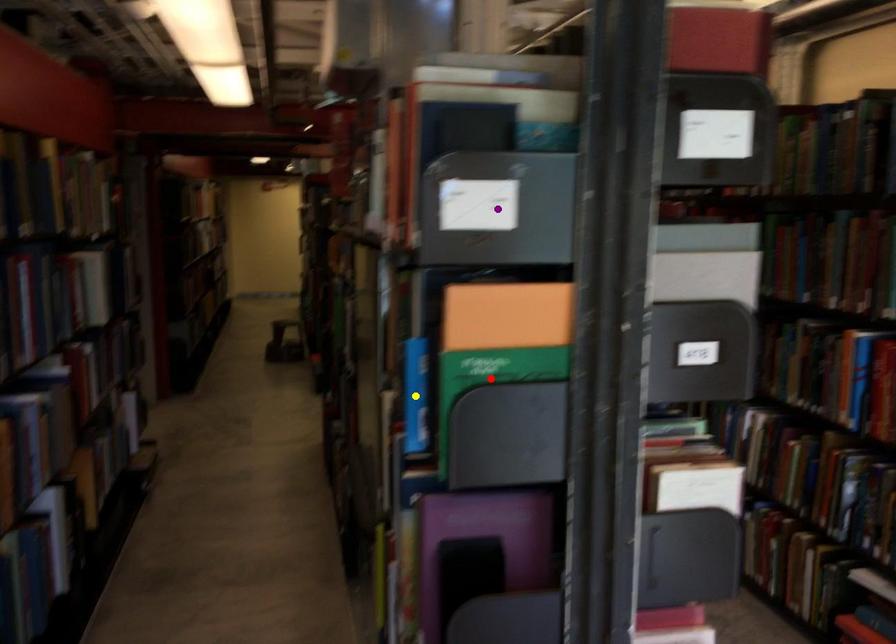
Order these from farthest to nearest:
A) yellow point
B) purple point
C) red point

1. yellow point
2. red point
3. purple point